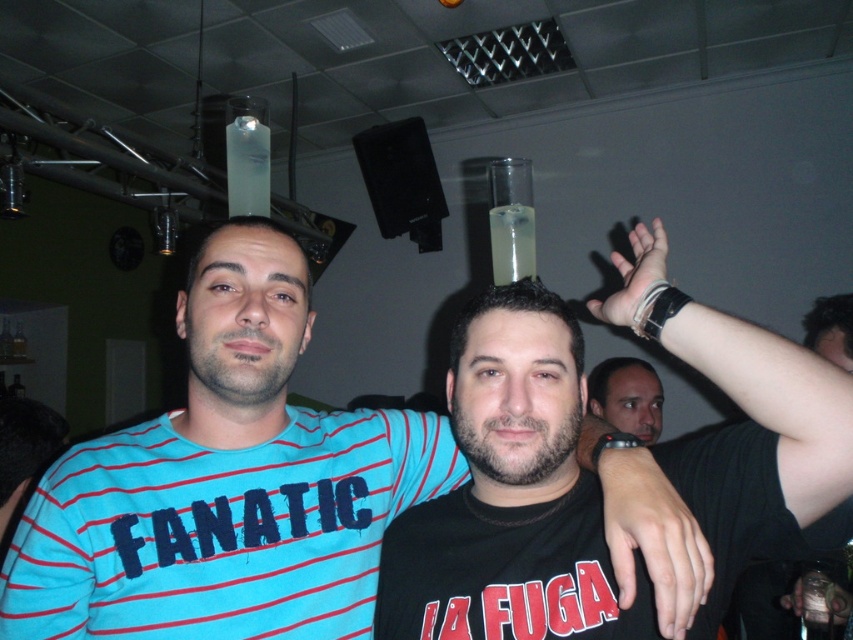
Is black matte shirt at center smaller than smooth skin face at center?

Incorrect, black matte shirt at center is not smaller in size than smooth skin face at center.

Is point (544, 352) closer to camera compared to point (621, 419)?

Yes, point (544, 352) is closer to viewer.

This screenshot has height=640, width=853. Identify the location of black matte shirt at center. (508, 504).